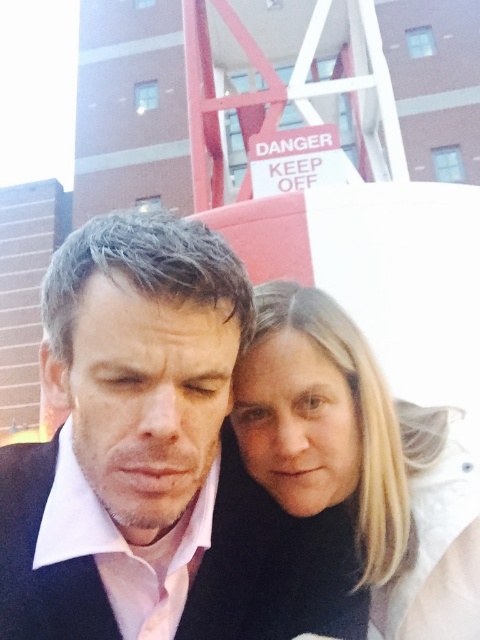
You are a photographer trying to capture a candid shot of the two people in the scene. Since you want to focus on the pink satin shirt at center and the black matte suit at center, which one should you adjust your camera focus to prioritize if you want the one closer to you to be sharp?

The pink satin shirt at center is closer to the viewer than the black matte suit at center, so you should prioritize focusing on the pink satin shirt at center to ensure it is sharp.

You are an architect designing a safety zone around the red and white construction crane in the image. The safety zone must be 2 meters wider than the height difference between the pink satin shirt at center and the blonde hair at center. What should be the minimum width of the safety zone?

The pink satin shirt at center has a greater height compared to blonde hair at center. The height difference between them is not specified, so the safety zone width cannot be determined with the given information.

You are a safety inspector assessing the scene. The blonde hair at center and the black matte suit at center are both in the danger zone marked by the crane. Which object is closer to the crane? Please explain your reasoning based on their positions.

The blonde hair at center is much taller than the black matte suit at center, so it is closer to the crane.